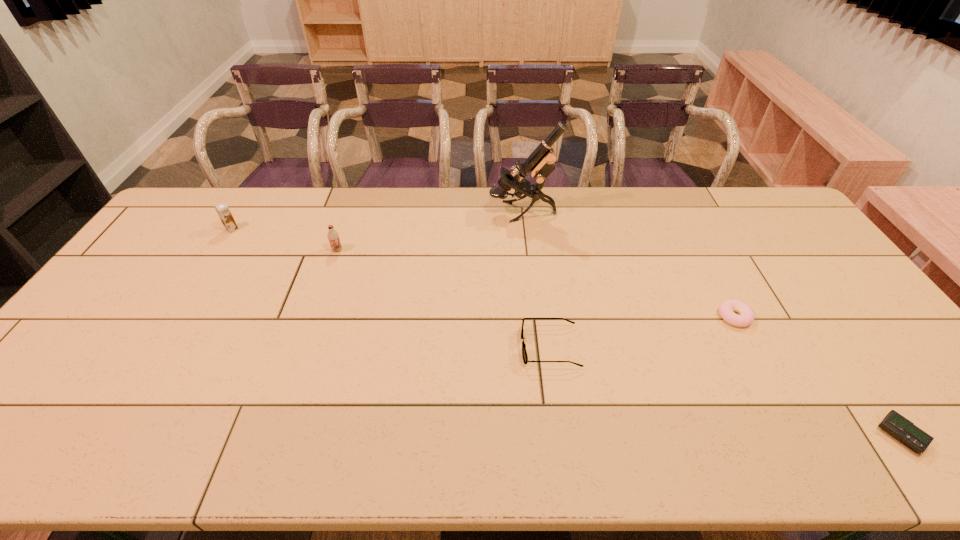
The height and width of the screenshot is (540, 960). In order to click on beeper in this screenshot , I will do `click(903, 430)`.

Where is `blank space located 0.330m through the eyepiece of the farthest object`? blank space located 0.330m through the eyepiece of the farthest object is located at coordinates (396, 212).

What are the coordinates of `blank space located 0.120m through the eyepiece of the farthest object` in the screenshot? It's located at (455, 212).

Locate an element on the screen. The image size is (960, 540). vacant area situated through the eyepiece of the farthest object is located at coordinates (419, 212).

This screenshot has width=960, height=540. I want to click on vacant space situated on the right of the left chocolate milk, so click(x=300, y=230).

Find the location of a particular element. vacant point located on the right of the nearer chocolate milk is located at coordinates (364, 250).

Where is `vacant space situated 0.330m on the front-facing side of the spectacles`? The width and height of the screenshot is (960, 540). vacant space situated 0.330m on the front-facing side of the spectacles is located at coordinates (395, 347).

This screenshot has width=960, height=540. What are the coordinates of `free space located 0.390m on the front-facing side of the spectacles` in the screenshot? It's located at (372, 347).

Locate an element on the screen. This screenshot has height=540, width=960. vacant space located on the front-facing side of the spectacles is located at coordinates (475, 347).

Where is `vacant space located 0.340m on the back of the fifth object from left to right`? The width and height of the screenshot is (960, 540). vacant space located 0.340m on the back of the fifth object from left to right is located at coordinates (688, 229).